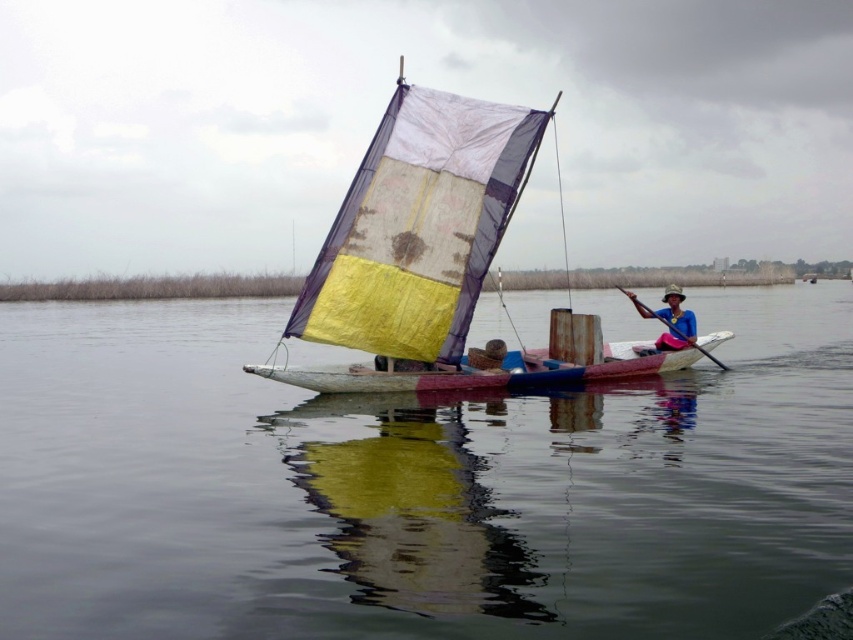
Question: Can you confirm if transparent water at center is smaller than yellow fabric sailboat at center?

Choices:
 (A) no
 (B) yes

Answer: (B)

Question: Which point is closer to the camera taking this photo?

Choices:
 (A) (413, 172)
 (B) (47, 628)

Answer: (B)

Question: Is transparent water at center to the left of wooden smooth paddle at center from the viewer's perspective?

Choices:
 (A) no
 (B) yes

Answer: (B)

Question: Estimate the real-world distances between objects in this image. Which object is closer to the blue fabric hat at center?

Choices:
 (A) wooden smooth paddle at center
 (B) yellow fabric sailboat at center
 (C) transparent water at center

Answer: (A)

Question: Which object is positioned closest to the yellow fabric sailboat at center?

Choices:
 (A) blue fabric hat at center
 (B) transparent water at center
 (C) wooden smooth paddle at center

Answer: (A)

Question: Is blue fabric hat at center in front of wooden smooth paddle at center?

Choices:
 (A) no
 (B) yes

Answer: (B)